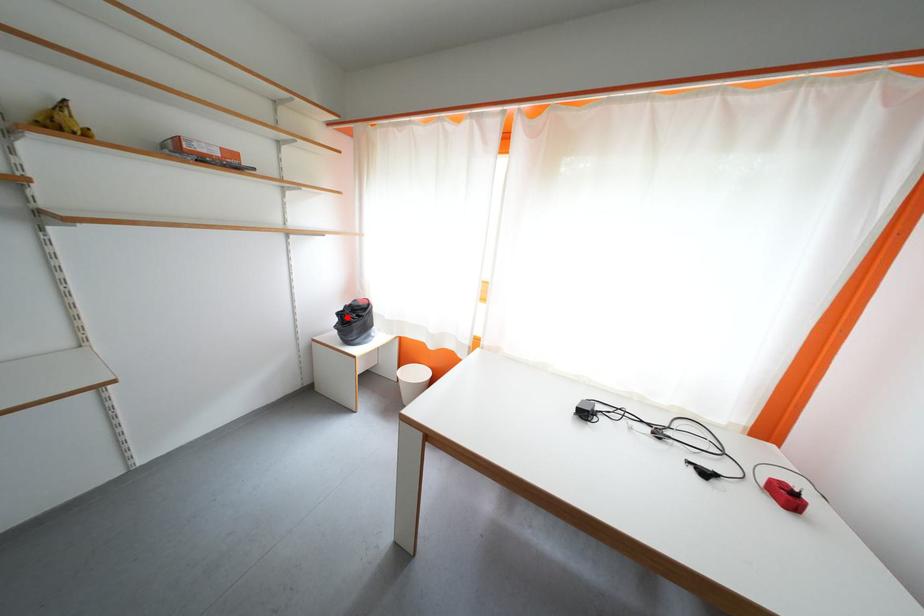
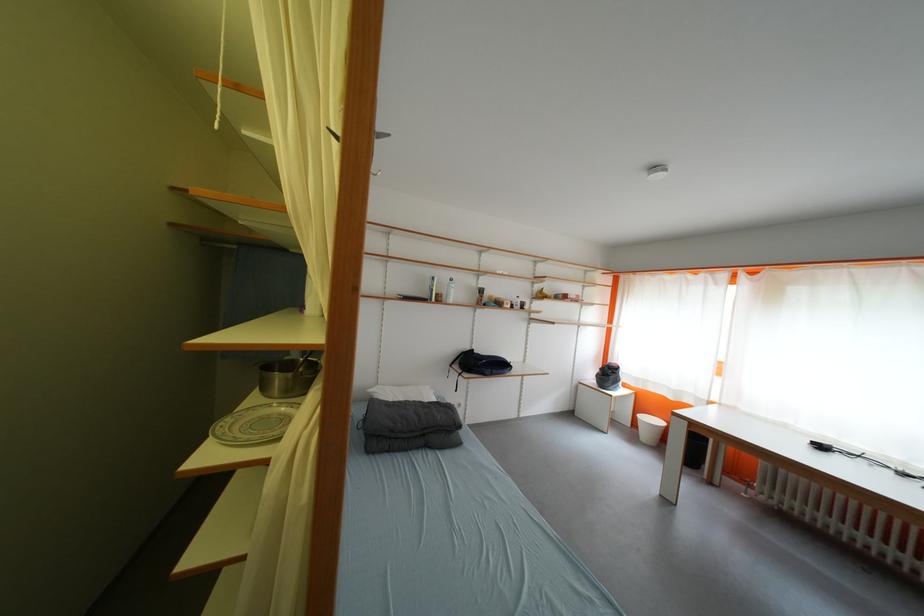
Question: I am providing you with two images of the same scene from different viewpoints. A red point is marked on the first image. At the location where the point appears in image 1, is it still visible in image 2?

Choices:
 (A) Yes
 (B) No

Answer: (A)